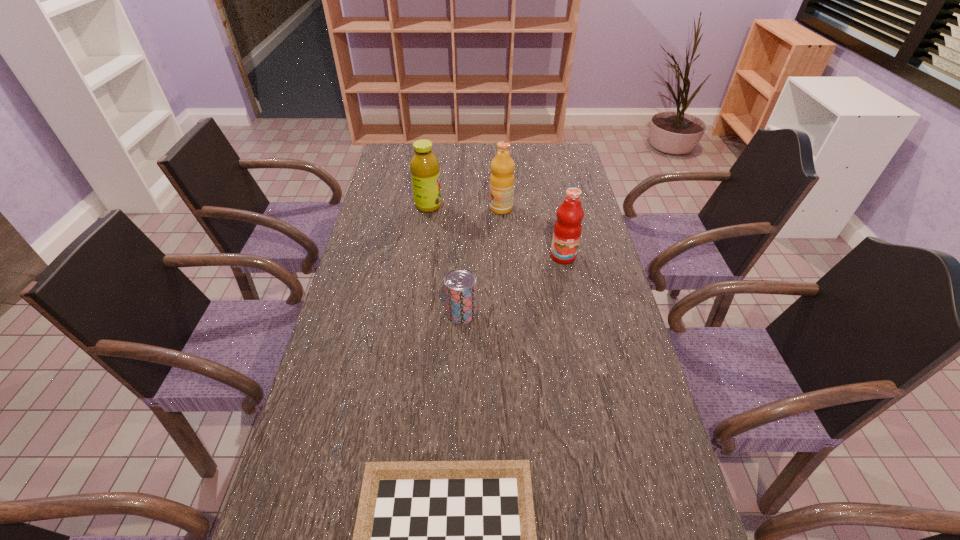
The width and height of the screenshot is (960, 540). Find the location of `free spot between the second fruit juice from left to right and the leftmost fruit juice`. free spot between the second fruit juice from left to right and the leftmost fruit juice is located at coordinates (465, 207).

Where is `free space that is in between the fourth farthest object and the nearest fruit juice`? The image size is (960, 540). free space that is in between the fourth farthest object and the nearest fruit juice is located at coordinates (513, 285).

You are a GUI agent. You are given a task and a screenshot of the screen. Output one action in this format:
    pyautogui.click(x=<x>, y=<y>)
    Task: Click on the free space between the second fruit juice from left to right and the leftmost fruit juice
    The height and width of the screenshot is (540, 960).
    Given the screenshot: What is the action you would take?
    pyautogui.click(x=465, y=207)

Where is `blank region between the leftmost fruit juice and the second fruit juice from right to left`? This screenshot has height=540, width=960. blank region between the leftmost fruit juice and the second fruit juice from right to left is located at coordinates (465, 207).

In order to click on free space between the second fruit juice from right to left and the rightmost object in this screenshot , I will do `click(532, 233)`.

Select which object appears as the fourth closest to the nearest fruit juice. Please provide its 2D coordinates. Your answer should be formatted as a tuple, i.e. [(x, y)], where the tuple contains the x and y coordinates of a point satisfying the conditions above.

[(433, 539)]

You are a GUI agent. You are given a task and a screenshot of the screen. Output one action in this format:
    pyautogui.click(x=<x>, y=<y>)
    Task: Click on the object that can be found as the closest to the second fruit juice from left to right
    
    Given the screenshot: What is the action you would take?
    pyautogui.click(x=424, y=165)

You are a GUI agent. You are given a task and a screenshot of the screen. Output one action in this format:
    pyautogui.click(x=<x>, y=<y>)
    Task: Click on the fruit juice that stands as the third closest to the fourth farthest object
    The image size is (960, 540).
    Given the screenshot: What is the action you would take?
    pyautogui.click(x=424, y=165)

Select which fruit juice appears as the second closest to the checkerboard. Please provide its 2D coordinates. Your answer should be formatted as a tuple, i.e. [(x, y)], where the tuple contains the x and y coordinates of a point satisfying the conditions above.

[(502, 166)]